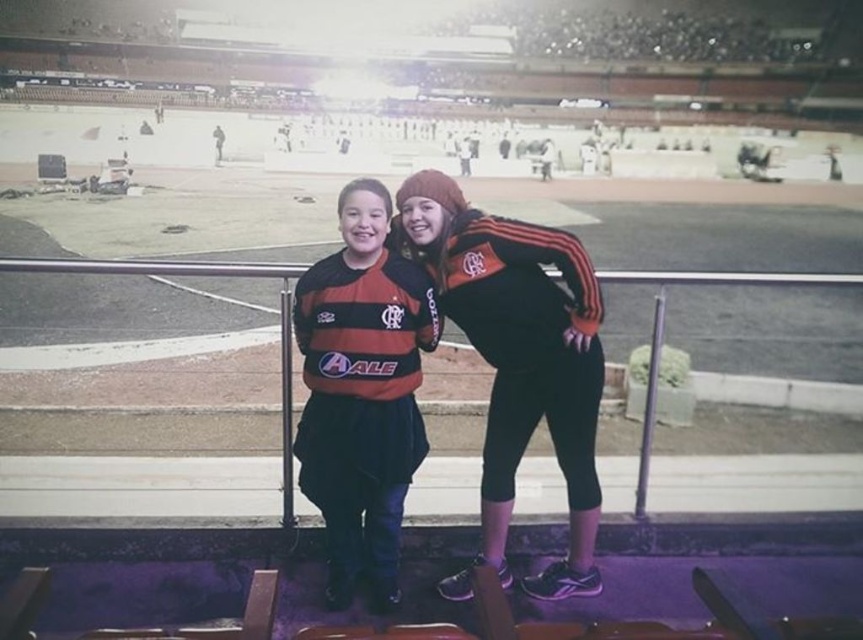
Question: Is black matte jacket at center wider than matte jersey at center?

Choices:
 (A) no
 (B) yes

Answer: (B)

Question: Which point appears closest to the camera in this image?

Choices:
 (A) (590, 477)
 (B) (329, 605)

Answer: (B)

Question: Can you confirm if black matte jacket at center is positioned to the right of matte jersey at center?

Choices:
 (A) no
 (B) yes

Answer: (B)

Question: Can you confirm if black matte jacket at center is smaller than matte jersey at center?

Choices:
 (A) yes
 (B) no

Answer: (B)

Question: Which point is closer to the camera?

Choices:
 (A) black matte jacket at center
 (B) matte jersey at center

Answer: (B)